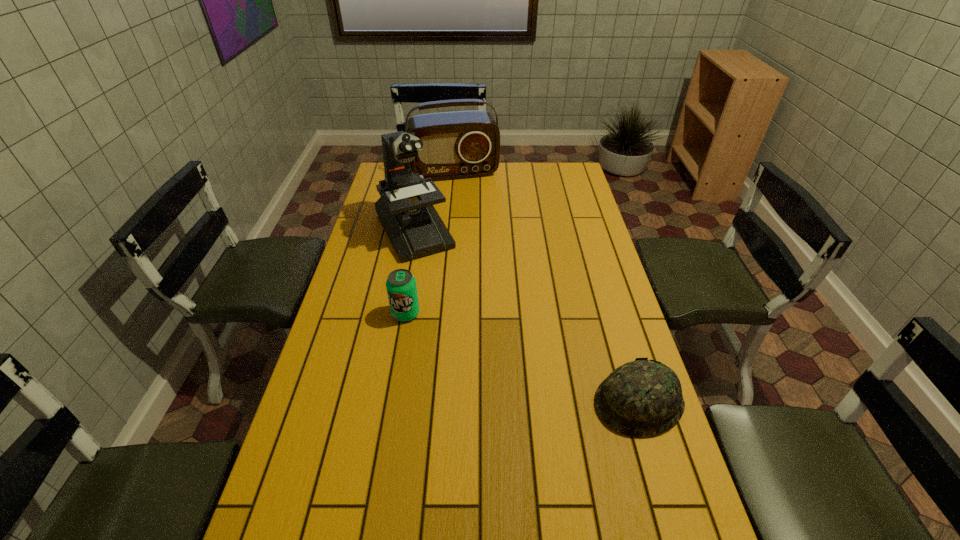
I want to click on blank area located 0.060m through the eyepieces of the third nearest object, so click(435, 271).

Where is `blank area located through the eyepieces of the third nearest object`? Image resolution: width=960 pixels, height=540 pixels. blank area located through the eyepieces of the third nearest object is located at coordinates (442, 283).

Where is `vacant space positioned 0.290m through the eyepieces of the third nearest object`? vacant space positioned 0.290m through the eyepieces of the third nearest object is located at coordinates click(461, 315).

The height and width of the screenshot is (540, 960). What are the coordinates of `vacant region located on the front panel of the farthest object` in the screenshot? It's located at (467, 200).

I want to click on vacant area located on the front panel of the farthest object, so click(x=477, y=237).

You are a GUI agent. You are given a task and a screenshot of the screen. Output one action in this format:
    pyautogui.click(x=<x>, y=<y>)
    Task: Click on the free location located 0.140m on the front panel of the farthest object
    The width and height of the screenshot is (960, 540).
    Given the screenshot: What is the action you would take?
    pyautogui.click(x=467, y=200)

At what (x,y) coordinates should I click in order to perform the action: click on object present at the far edge. Please return your answer as a coordinate pair (x, y). Looking at the image, I should click on (462, 144).

Locate an element on the screen. The height and width of the screenshot is (540, 960). microscope that is at the left edge is located at coordinates (405, 209).

Where is `radio receiver present at the left edge`? radio receiver present at the left edge is located at coordinates (462, 144).

Identify the location of object situated at the right edge. (641, 398).